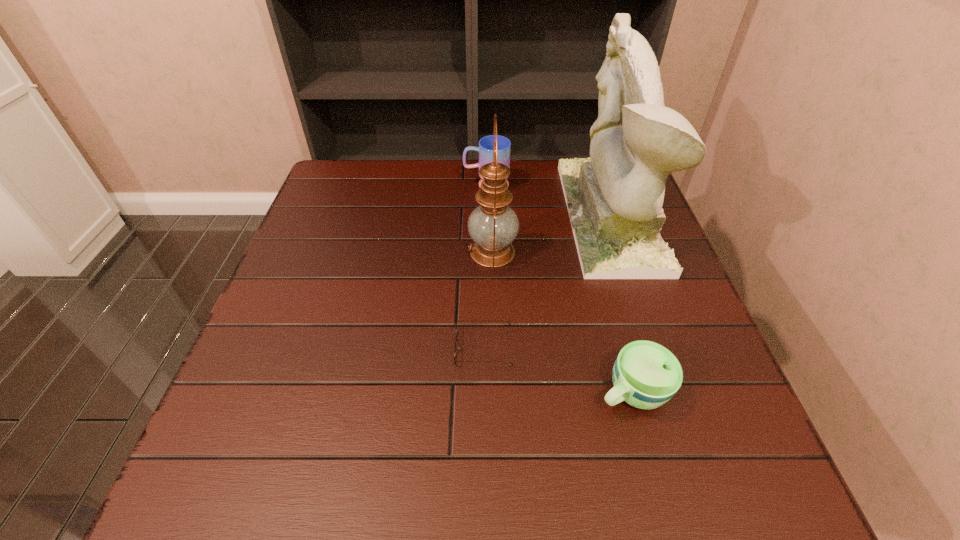
What are the coordinates of `free spot between the sculpture and the fourth tallest object` in the screenshot? It's located at (620, 303).

Locate an element on the screen. The width and height of the screenshot is (960, 540). free space between the second shortest object and the oil lamp is located at coordinates (562, 322).

Identify the location of vacant space that is in between the fourth tallest object and the tallest object. (620, 303).

Where is `unoccupied position between the third shortest object and the sunglasses`? unoccupied position between the third shortest object and the sunglasses is located at coordinates (485, 266).

Locate an element on the screen. vacant space that's between the sculpture and the oil lamp is located at coordinates (551, 234).

Find the location of a particular element. Image resolution: width=960 pixels, height=540 pixels. free space between the tallest object and the fourth shortest object is located at coordinates (551, 234).

Identify which object is the nearest to the sunglasses. Please provide its 2D coordinates. Your answer should be formatted as a tuple, i.e. [(x, y)], where the tuple contains the x and y coordinates of a point satisfying the conditions above.

[(646, 375)]

Choose which object is the nearest neighbor to the fourth tallest object. Please provide its 2D coordinates. Your answer should be formatted as a tuple, i.e. [(x, y)], where the tuple contains the x and y coordinates of a point satisfying the conditions above.

[(456, 338)]

Identify the location of free space in the image that satisfies the following two spatial constraints: 1. on the front side of the second tallest object; 2. on the left side of the cup. (496, 392).

At what (x,y) coordinates should I click in order to perform the action: click on vacant point that satisfies the following two spatial constraints: 1. on the front side of the oil lamp; 2. on the front-facing side of the sunglasses. Please return your answer as a coordinate pair (x, y). Looking at the image, I should click on 495,348.